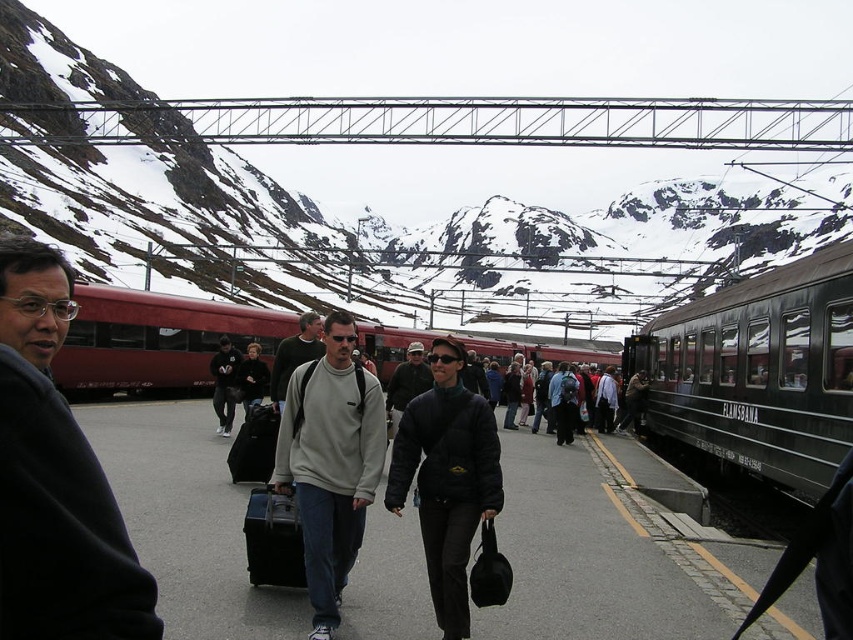
You are a tour guide leading a group at the train station. You need to ensure that the distance between the light gray sweatshirt at center and the matte black suitcase at center is at least 5 meters for safety. Is the current distance sufficient?

The light gray sweatshirt at center is 4.21 meters from the matte black suitcase at center, which is less than the required 5 meters. The current distance is insufficient for safety.

You are a photographer standing on the train station platform. You want to take a photo of the snowy rock at upper center and the matte black suitcase at center. Which object should you focus on first if you want to capture both in a single frame without moving the camera?

The snowy rock at upper center is positioned over the matte black suitcase at center, so you should focus on the snowy rock at upper center first to ensure both are in the frame.

You are a photographer standing on the train station platform. You want to take a photo of the light gray sweatshirt at center and the matte black suitcase at center. Which object is positioned higher in the frame?

The light gray sweatshirt at center is positioned higher than the matte black suitcase at center in the frame.